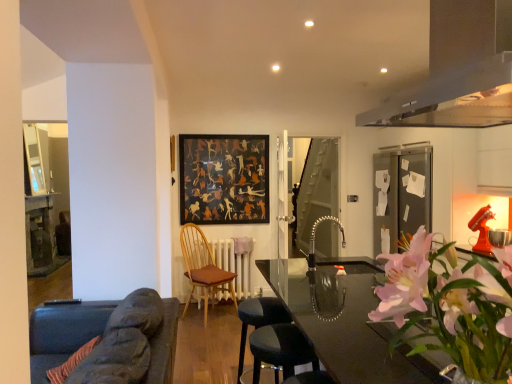
Question: Does black matte picture frame at center have a lesser height compared to transparent glass table at center, marked as the first table in a right-to-left arrangement?

Choices:
 (A) no
 (B) yes

Answer: (A)

Question: Is black matte picture frame at center to the right of transparent glass table at center, the 2th table viewed from the left, from the viewer's perspective?

Choices:
 (A) yes
 (B) no

Answer: (B)

Question: Could transparent glass table at center, the 2th table viewed from the left, be considered to be inside black matte picture frame at center?

Choices:
 (A) yes
 (B) no

Answer: (B)

Question: Is black matte picture frame at center smaller than transparent glass table at center, acting as the 1th table starting from the front?

Choices:
 (A) no
 (B) yes

Answer: (B)

Question: Can you confirm if black matte picture frame at center is thinner than transparent glass table at center, the 2th table viewed from the left?

Choices:
 (A) no
 (B) yes

Answer: (B)

Question: Is wooden table at left, the 2th table when ordered from front to back, to the left or to the right of wooden chair with brown cushion at center in the image?

Choices:
 (A) right
 (B) left

Answer: (B)

Question: In terms of width, does wooden table at left, which is the first table in back-to-front order, look wider or thinner when compared to wooden chair with brown cushion at center?

Choices:
 (A) thin
 (B) wide

Answer: (A)

Question: Is wooden table at left, acting as the 2th table starting from the right, inside or outside of wooden chair with brown cushion at center?

Choices:
 (A) inside
 (B) outside

Answer: (B)

Question: Is wooden table at left, the 2th table when ordered from front to back, in front of or behind wooden chair with brown cushion at center in the image?

Choices:
 (A) behind
 (B) front

Answer: (A)

Question: From the image's perspective, is wooden chair with brown cushion at center located above or below wooden table at left, the first table positioned from the left?

Choices:
 (A) below
 (B) above

Answer: (A)

Question: Is point (207, 281) closer or farther from the camera than point (44, 244)?

Choices:
 (A) closer
 (B) farther

Answer: (A)

Question: In the image, is wooden chair with brown cushion at center on the left side or the right side of wooden table at left, the first table positioned from the left?

Choices:
 (A) right
 (B) left

Answer: (A)

Question: Considering the positions of wooden chair with brown cushion at center and wooden table at left, which is the first table in back-to-front order, in the image, is wooden chair with brown cushion at center wider or thinner than wooden table at left, which is the first table in back-to-front order,?

Choices:
 (A) wide
 (B) thin

Answer: (A)

Question: From a real-world perspective, is transparent glass table at center, acting as the 1th table starting from the front, above or below white painted radiator at center?

Choices:
 (A) below
 (B) above

Answer: (B)

Question: Is transparent glass table at center, which ranks as the second table in back-to-front order, in front of or behind white painted radiator at center in the image?

Choices:
 (A) behind
 (B) front

Answer: (B)